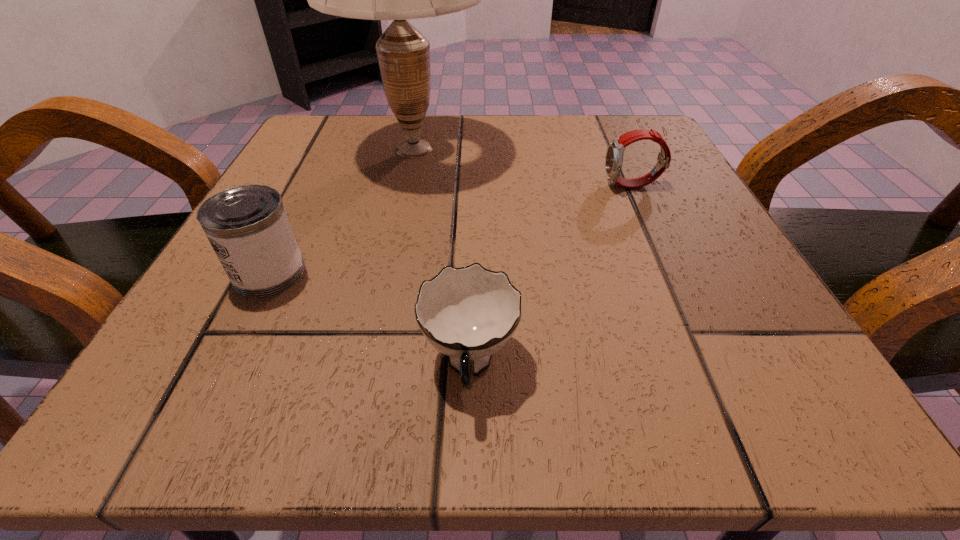
At what (x,y) coordinates should I click in order to perform the action: click on object situated at the near edge. Please return your answer as a coordinate pair (x, y). The width and height of the screenshot is (960, 540). Looking at the image, I should click on (468, 314).

Where is `lampshade that is positioned at the left edge`? lampshade that is positioned at the left edge is located at coordinates (403, 53).

This screenshot has height=540, width=960. In order to click on can that is at the left edge in this screenshot , I will do `click(247, 226)`.

This screenshot has height=540, width=960. I want to click on object located at the right edge, so click(x=614, y=156).

This screenshot has width=960, height=540. Find the location of `object located in the far left corner section of the desktop`. object located in the far left corner section of the desktop is located at coordinates (403, 53).

Locate an element on the screen. This screenshot has height=540, width=960. vacant space at the far edge of the desktop is located at coordinates tap(492, 162).

The height and width of the screenshot is (540, 960). In the image, there is a desktop. What are the coordinates of `free space at the left edge` in the screenshot? It's located at (318, 261).

Find the location of a particular element. vacant region at the far left corner of the desktop is located at coordinates (355, 171).

Locate an element on the screen. free space at the far right corner of the desktop is located at coordinates (674, 155).

Locate an element on the screen. The width and height of the screenshot is (960, 540). vacant region at the near right corner of the desktop is located at coordinates (774, 396).